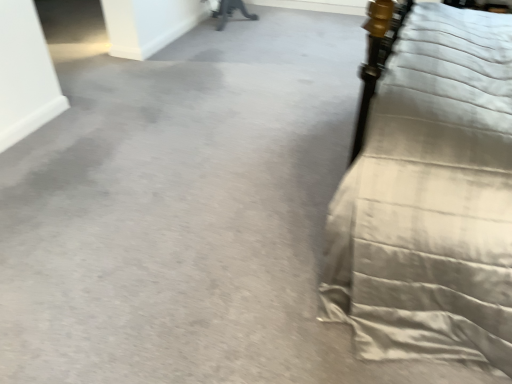
The width and height of the screenshot is (512, 384). Identify the location of white satin bed at right. (431, 200).

The height and width of the screenshot is (384, 512). What do you see at coordinates (431, 200) in the screenshot?
I see `white satin bed at right` at bounding box center [431, 200].

Identify the location of white satin bed at right. (431, 200).